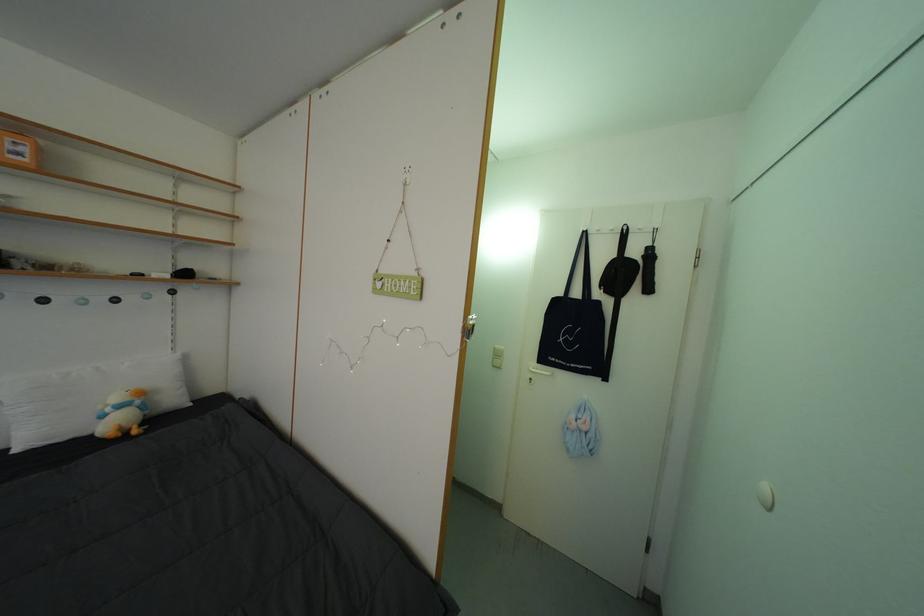
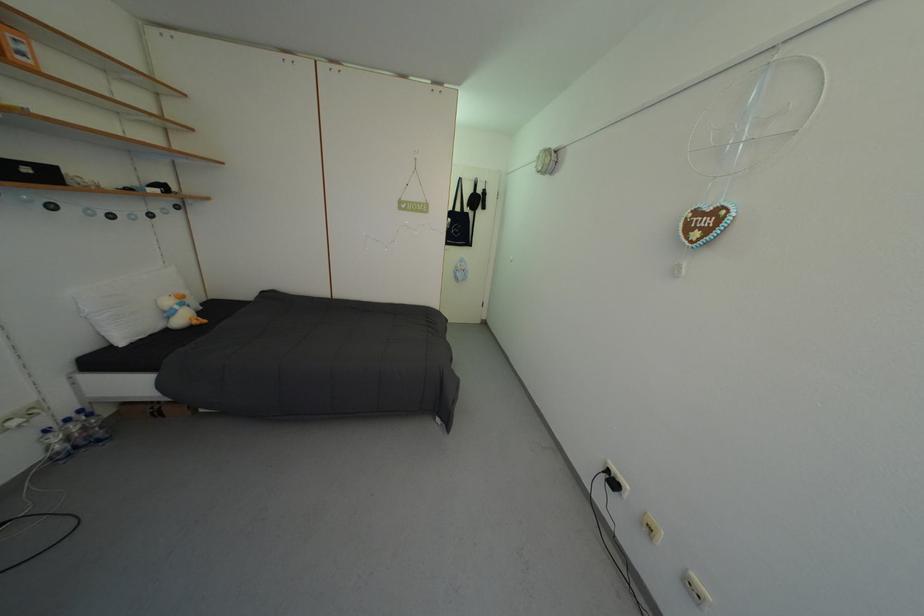
The point at (150, 400) is marked in the first image. Where is the corresponding point in the second image?

(190, 302)